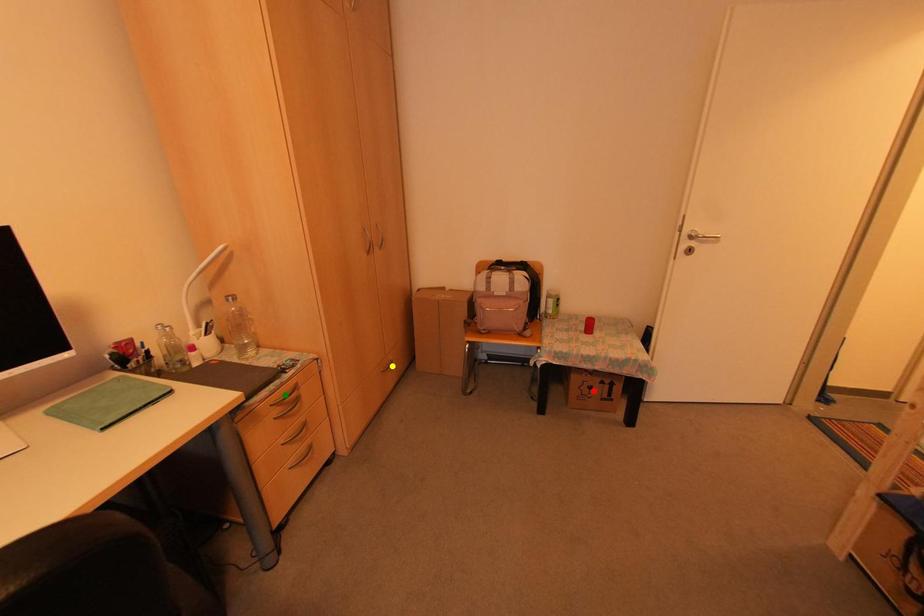
Order these from nearest to farthest:
1. green point
2. red point
3. yellow point

green point < red point < yellow point